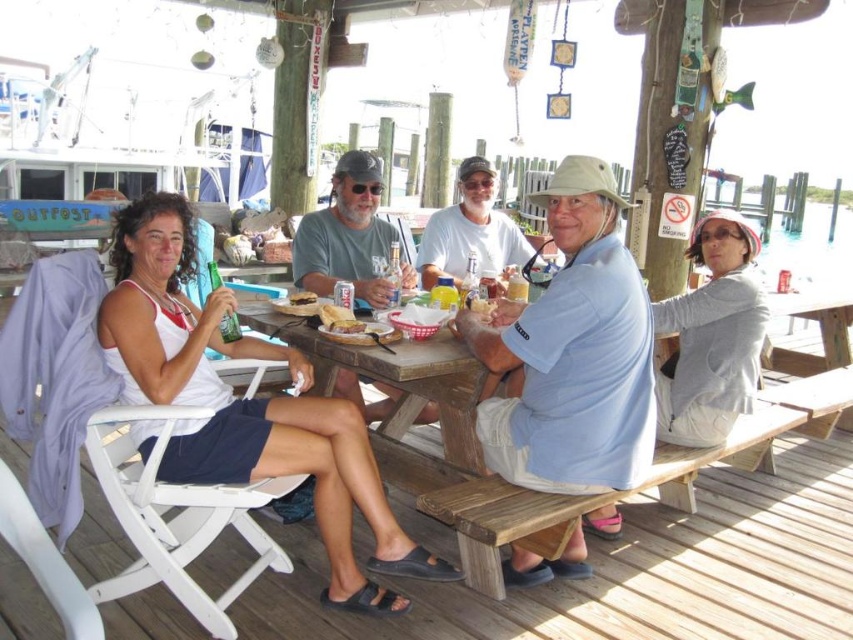
Question: Does wooden bench at lower center appear over gray cotton sweater at upper right?

Choices:
 (A) no
 (B) yes

Answer: (A)

Question: Is wooden bench at lower center closer to the viewer compared to white fabric tank top at left?

Choices:
 (A) no
 (B) yes

Answer: (B)

Question: Which object appears closest to the camera in this image?

Choices:
 (A) light blue cotton shirt at center
 (B) white fabric tank top at left

Answer: (B)

Question: Which point appears closest to the camera in this image?

Choices:
 (A) (419, 266)
 (B) (160, 378)

Answer: (B)

Question: Which point is farther to the camera?

Choices:
 (A) light blue cotton shirt at center
 (B) white cotton shirt at center
 (C) gray cotton sweater at upper right

Answer: (B)

Question: Does wooden picnic table at center come in front of slightly toasted bread at center?

Choices:
 (A) yes
 (B) no

Answer: (A)